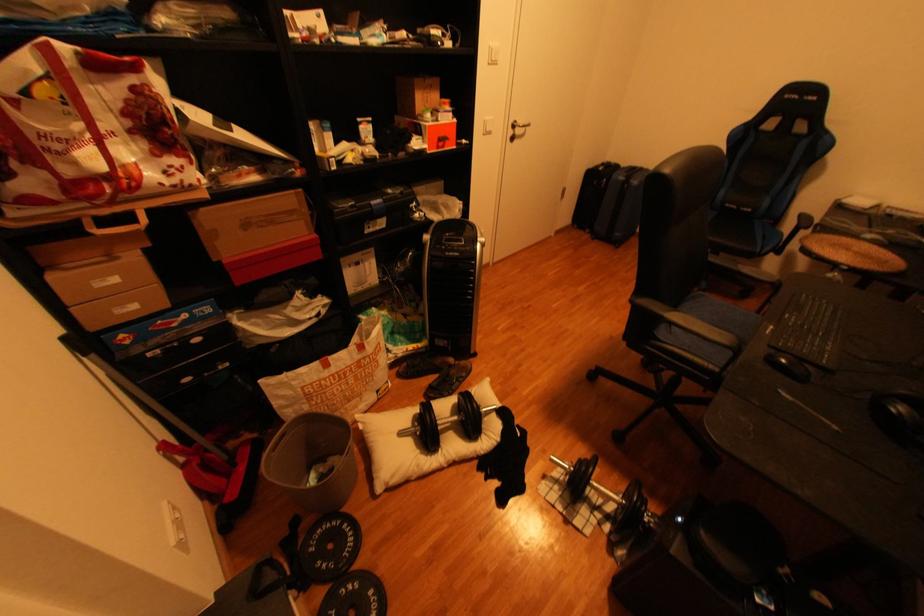
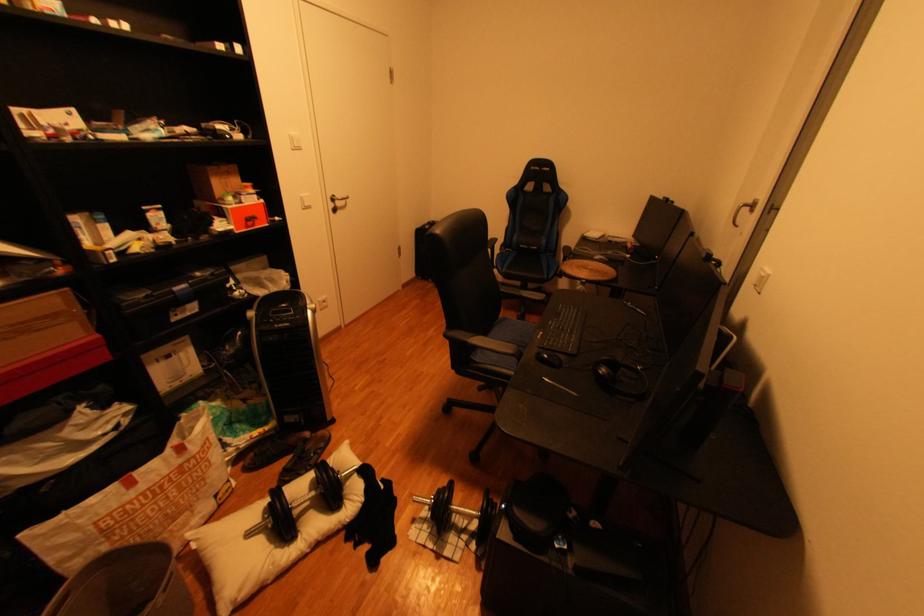
The point at (x=525, y=121) is marked in the first image. Where is the corresponding point in the second image?

(345, 197)